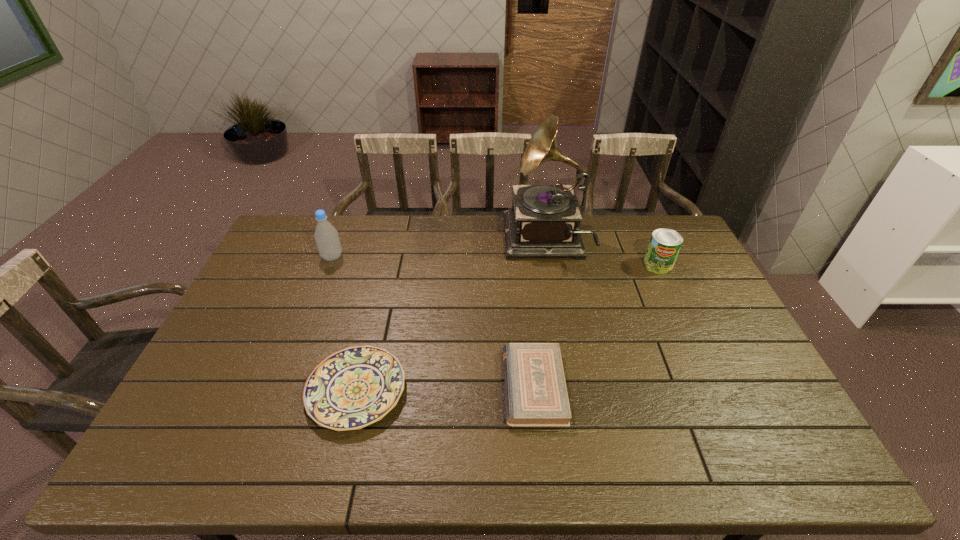
Find the location of `object at the right edge`. object at the right edge is located at coordinates (664, 246).

This screenshot has width=960, height=540. Find the location of `free spot at the far edge of the desktop`. free spot at the far edge of the desktop is located at coordinates (379, 218).

This screenshot has width=960, height=540. I want to click on free space at the near edge of the desktop, so click(x=470, y=441).

The image size is (960, 540). What are the coordinates of `vacant space at the left edge of the desktop` in the screenshot? It's located at (274, 339).

The width and height of the screenshot is (960, 540). I want to click on vacant space at the right edge of the desktop, so click(x=706, y=286).

You are a GUI agent. You are given a task and a screenshot of the screen. Output one action in this format:
    pyautogui.click(x=<x>, y=<y>)
    Task: Click on the free space at the far left corner
    
    Given the screenshot: What is the action you would take?
    pyautogui.click(x=329, y=215)

I want to click on free space at the near left corner of the desktop, so [193, 443].

I want to click on vacant space that's between the fourth object from right to left and the can, so click(507, 328).

This screenshot has height=540, width=960. Identify the location of empty space that is in between the fourth shortest object and the fourth tallest object. (433, 322).

The image size is (960, 540). I want to click on free area in between the record player and the Bible, so click(540, 314).